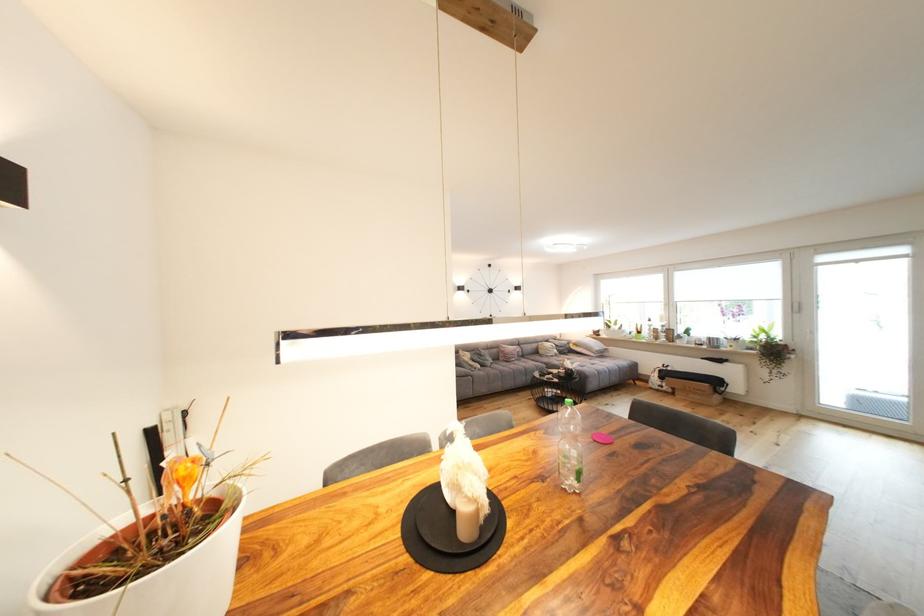
Describe the element at coordinates (580, 342) in the screenshot. The height and width of the screenshot is (616, 924). I see `the sofa armrest` at that location.